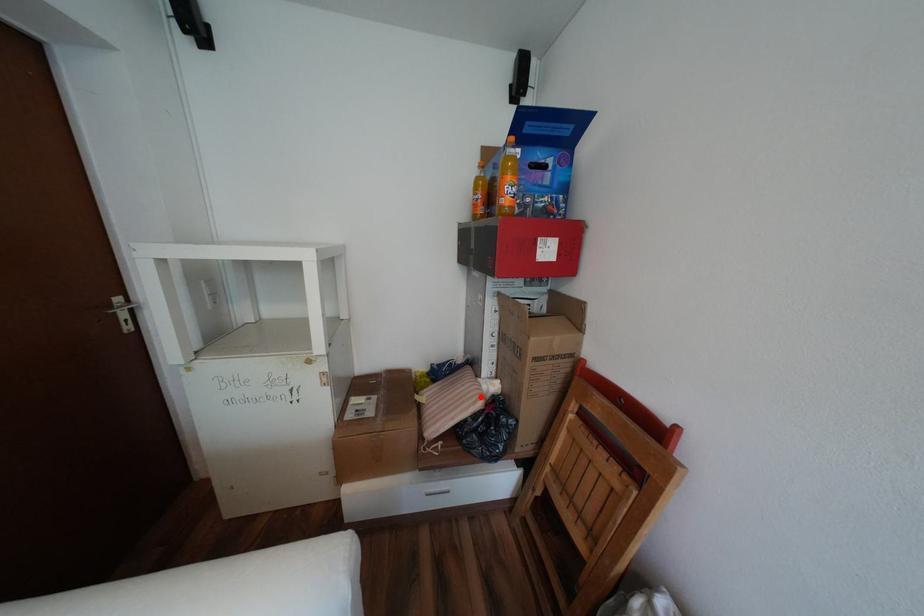
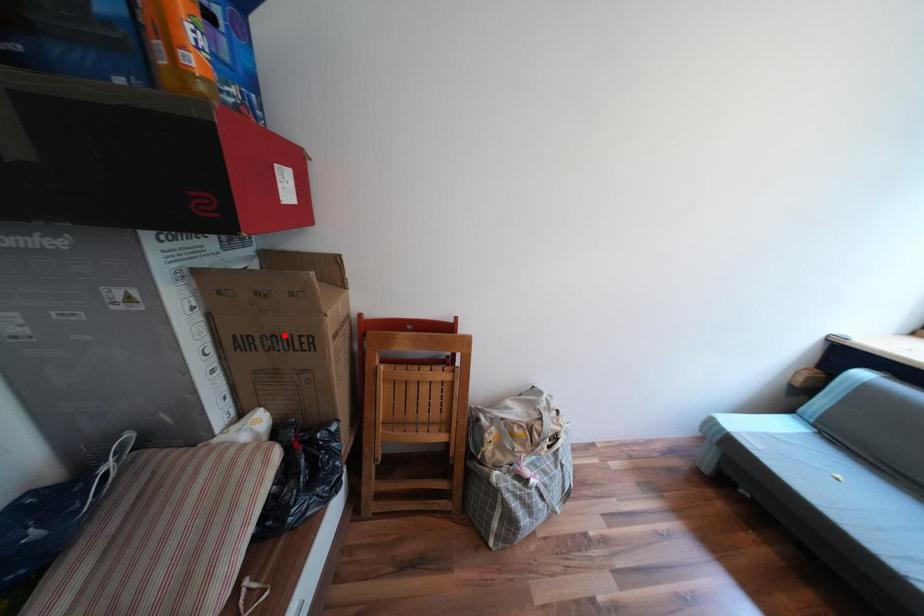
I am providing you with two images of the same scene from different viewpoints. A red point is marked on the first image and another point is marked on the second image. Do the highlighted points in image1 and image2 indicate the same real-world spot?

No